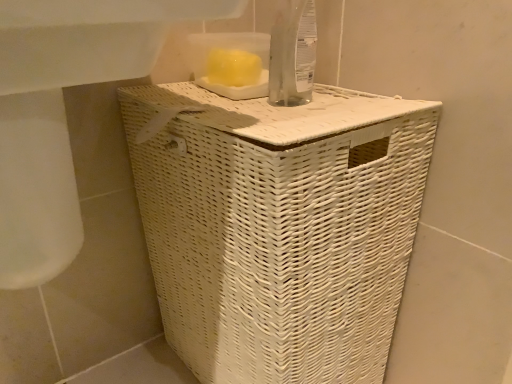
Question: Is white wicker basket at lower center not inside white wicker laundry basket at center?

Choices:
 (A) no
 (B) yes

Answer: (B)

Question: Is white wicker basket at lower center positioned in front of white wicker laundry basket at center?

Choices:
 (A) yes
 (B) no

Answer: (A)

Question: Does white wicker basket at lower center appear on the right side of white wicker laundry basket at center?

Choices:
 (A) no
 (B) yes

Answer: (A)

Question: Does white wicker basket at lower center come behind white wicker laundry basket at center?

Choices:
 (A) no
 (B) yes

Answer: (A)

Question: From a real-world perspective, is white wicker basket at lower center positioned under white wicker laundry basket at center based on gravity?

Choices:
 (A) no
 (B) yes

Answer: (A)

Question: Is white wicker basket at lower center at the left side of white wicker laundry basket at center?

Choices:
 (A) yes
 (B) no

Answer: (A)

Question: Considering the relative sizes of white wicker laundry basket at center and white wicker basket at lower center in the image provided, is white wicker laundry basket at center taller than white wicker basket at lower center?

Choices:
 (A) no
 (B) yes

Answer: (B)

Question: Does white wicker laundry basket at center contain white wicker basket at lower center?

Choices:
 (A) yes
 (B) no

Answer: (B)

Question: Is white wicker laundry basket at center not close to white wicker basket at lower center?

Choices:
 (A) no
 (B) yes

Answer: (A)

Question: From a real-world perspective, is white wicker laundry basket at center under white wicker basket at lower center?

Choices:
 (A) yes
 (B) no

Answer: (A)

Question: Considering the relative sizes of white wicker laundry basket at center and white wicker basket at lower center in the image provided, is white wicker laundry basket at center bigger than white wicker basket at lower center?

Choices:
 (A) no
 (B) yes

Answer: (B)

Question: Is white wicker laundry basket at center shorter than white wicker basket at lower center?

Choices:
 (A) no
 (B) yes

Answer: (A)

Question: From a real-world perspective, is white wicker laundry basket at center positioned above or below white wicker basket at lower center?

Choices:
 (A) below
 (B) above

Answer: (A)